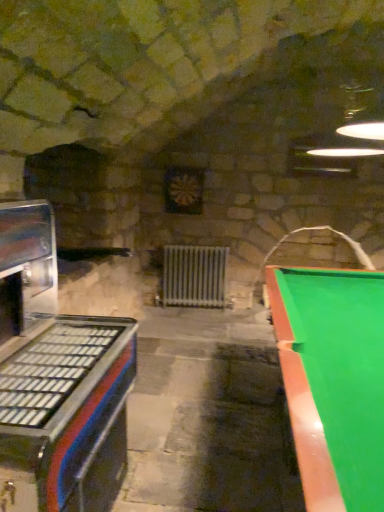
Question: Is white metallic radiator at center to the right of green glossy pool table at right from the viewer's perspective?

Choices:
 (A) no
 (B) yes

Answer: (A)

Question: Considering the relative sizes of white metallic radiator at center and green glossy pool table at right in the image provided, is white metallic radiator at center taller than green glossy pool table at right?

Choices:
 (A) yes
 (B) no

Answer: (B)

Question: Is white metallic radiator at center smaller than green glossy pool table at right?

Choices:
 (A) no
 (B) yes

Answer: (B)

Question: Does white metallic radiator at center contain green glossy pool table at right?

Choices:
 (A) yes
 (B) no

Answer: (B)

Question: Does white metallic radiator at center lie behind green glossy pool table at right?

Choices:
 (A) no
 (B) yes

Answer: (B)

Question: Considering the positions of point (322, 458) and point (14, 233), is point (322, 458) closer or farther from the camera than point (14, 233)?

Choices:
 (A) farther
 (B) closer

Answer: (B)

Question: In terms of size, does green glossy pool table at right appear bigger or smaller than metallic blue and red arcade machine at left?

Choices:
 (A) big
 (B) small

Answer: (A)

Question: Based on their positions, is green glossy pool table at right located to the left or right of metallic blue and red arcade machine at left?

Choices:
 (A) left
 (B) right

Answer: (B)

Question: In terms of width, does green glossy pool table at right look wider or thinner when compared to metallic blue and red arcade machine at left?

Choices:
 (A) thin
 (B) wide

Answer: (B)

Question: Looking at the image, does metallic blue and red arcade machine at left seem bigger or smaller compared to white metallic radiator at center?

Choices:
 (A) small
 (B) big

Answer: (B)

Question: Would you say metallic blue and red arcade machine at left is inside or outside white metallic radiator at center?

Choices:
 (A) outside
 (B) inside

Answer: (A)

Question: Is metallic blue and red arcade machine at left taller or shorter than white metallic radiator at center?

Choices:
 (A) short
 (B) tall

Answer: (B)

Question: Does point (13, 422) appear closer or farther from the camera than point (170, 278)?

Choices:
 (A) farther
 (B) closer

Answer: (B)

Question: Considering their positions, is metallic blue and red arcade machine at left located in front of or behind green glossy pool table at right?

Choices:
 (A) behind
 (B) front

Answer: (A)

Question: From the image's perspective, relative to green glossy pool table at right, is metallic blue and red arcade machine at left above or below?

Choices:
 (A) above
 (B) below

Answer: (A)